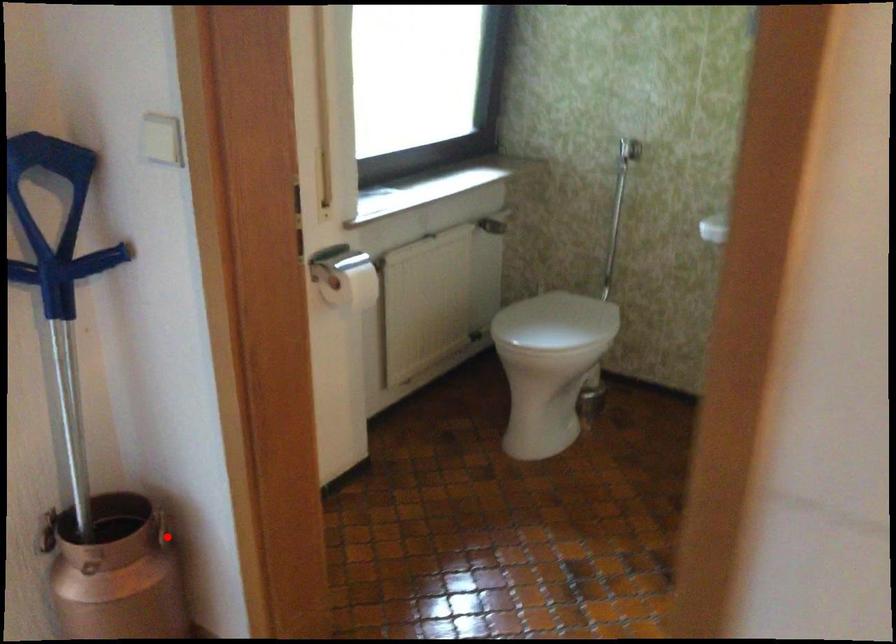
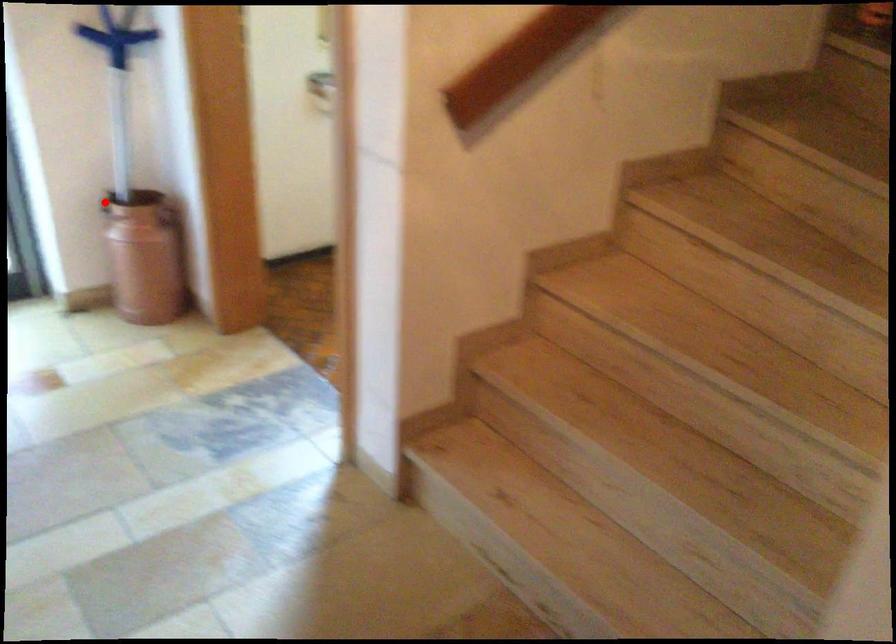
I am providing you with two images of the same scene from different viewpoints. A red point is marked on the first image and another point is marked on the second image. Does the point marked in image1 correspond to the same location as the one in image2?

No